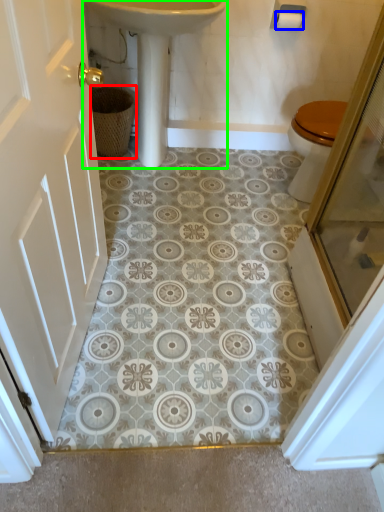
Question: Considering the real-world distances, which object is farthest from basket (highlighted by a red box)? toilet paper (highlighted by a blue box) or sink (highlighted by a green box)?

Choices:
 (A) toilet paper
 (B) sink

Answer: (A)